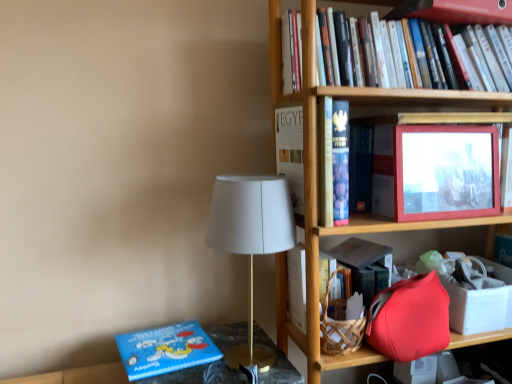
The height and width of the screenshot is (384, 512). Find the location of `vacant space situated above blue matte board book at lower left, positioned as the first book in left-to-right order (from a real-world perspective)`. vacant space situated above blue matte board book at lower left, positioned as the first book in left-to-right order (from a real-world perspective) is located at coordinates (164, 343).